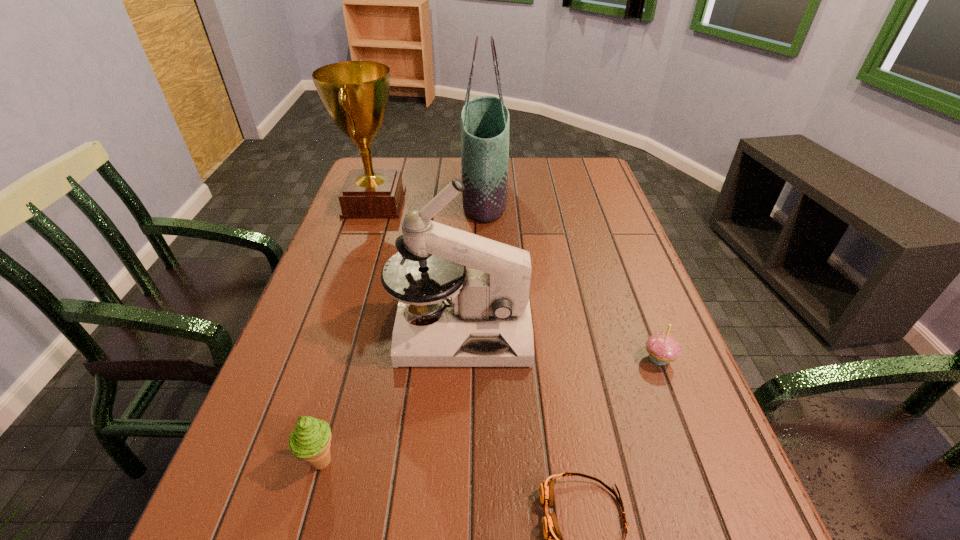
Locate an element on the screen. The image size is (960, 540). tote bag is located at coordinates (485, 121).

Locate an element on the screen. The image size is (960, 540). award is located at coordinates (355, 93).

Locate an element on the screen. microscope is located at coordinates (484, 313).

Locate an element on the screen. The height and width of the screenshot is (540, 960). the third shortest object is located at coordinates (310, 440).

Find the location of a particular element. cupcake is located at coordinates (662, 348).

Where is `the rightmost object`? The height and width of the screenshot is (540, 960). the rightmost object is located at coordinates (662, 348).

You are a GUI agent. You are given a task and a screenshot of the screen. Output one action in this format:
    pyautogui.click(x=<x>, y=<y>)
    Task: Click on the vacant position located 0.100m on the left of the tallest object
    
    Given the screenshot: What is the action you would take?
    pyautogui.click(x=431, y=195)

Identify the location of free spot located on the plaque of the award. (519, 203).

The height and width of the screenshot is (540, 960). In order to click on free region located 0.290m at the eyepiece of the microscope in this screenshot , I will do pos(661,330).

Where is `free location located on the back of the fourth tallest object`? The width and height of the screenshot is (960, 540). free location located on the back of the fourth tallest object is located at coordinates (369, 291).